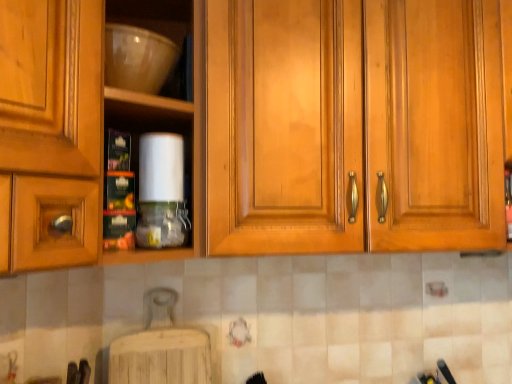
Question: Is matte wood cabinets at center positioned behind matte white bowl at upper left?

Choices:
 (A) no
 (B) yes

Answer: (B)

Question: Does matte wood cabinets at center have a lesser width compared to matte white bowl at upper left?

Choices:
 (A) no
 (B) yes

Answer: (A)

Question: Is matte wood cabinets at center positioned with its back to matte white bowl at upper left?

Choices:
 (A) no
 (B) yes

Answer: (A)

Question: From a real-world perspective, does matte wood cabinets at center stand above matte white bowl at upper left?

Choices:
 (A) yes
 (B) no

Answer: (A)

Question: Does matte wood cabinets at center have a greater width compared to matte white bowl at upper left?

Choices:
 (A) no
 (B) yes

Answer: (B)

Question: From the image's perspective, is matte wood cabinets at center on matte white bowl at upper left?

Choices:
 (A) yes
 (B) no

Answer: (B)

Question: Considering the relative sizes of matte white bowl at upper left and matte wood cabinets at center in the image provided, is matte white bowl at upper left smaller than matte wood cabinets at center?

Choices:
 (A) yes
 (B) no

Answer: (A)

Question: Is matte white bowl at upper left completely or partially outside of matte wood cabinets at center?

Choices:
 (A) yes
 (B) no

Answer: (A)

Question: From the image's perspective, is matte white bowl at upper left located above matte wood cabinets at center?

Choices:
 (A) yes
 (B) no

Answer: (A)

Question: Can you confirm if matte white bowl at upper left is taller than matte wood cabinets at center?

Choices:
 (A) no
 (B) yes

Answer: (A)

Question: Is matte white bowl at upper left at the left side of matte wood cabinets at center?

Choices:
 (A) yes
 (B) no

Answer: (A)

Question: Is matte white bowl at upper left with matte wood cabinets at center?

Choices:
 (A) yes
 (B) no

Answer: (B)

Question: Is translucent plastic bottle at center at the back of matte wood cabinets at center?

Choices:
 (A) no
 (B) yes

Answer: (A)